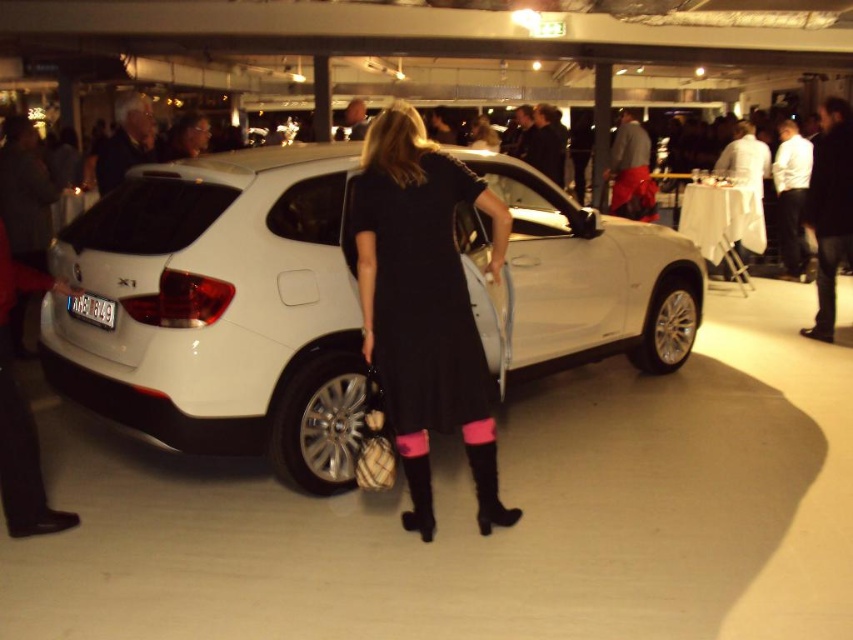
Question: Among these objects, which one is farthest from the camera?

Choices:
 (A) black matte dress at center
 (B) white metallic car at center

Answer: (B)

Question: Observing the image, what is the correct spatial positioning of white metallic car at center in reference to black matte dress at center?

Choices:
 (A) above
 (B) below

Answer: (A)

Question: Does white metallic car at center appear on the right side of black matte dress at center?

Choices:
 (A) no
 (B) yes

Answer: (A)

Question: Which of the following is the farthest from the observer?

Choices:
 (A) [x=463, y=285]
 (B) [x=531, y=216]

Answer: (B)

Question: Where is white metallic car at center located in relation to black matte dress at center in the image?

Choices:
 (A) right
 (B) left

Answer: (B)